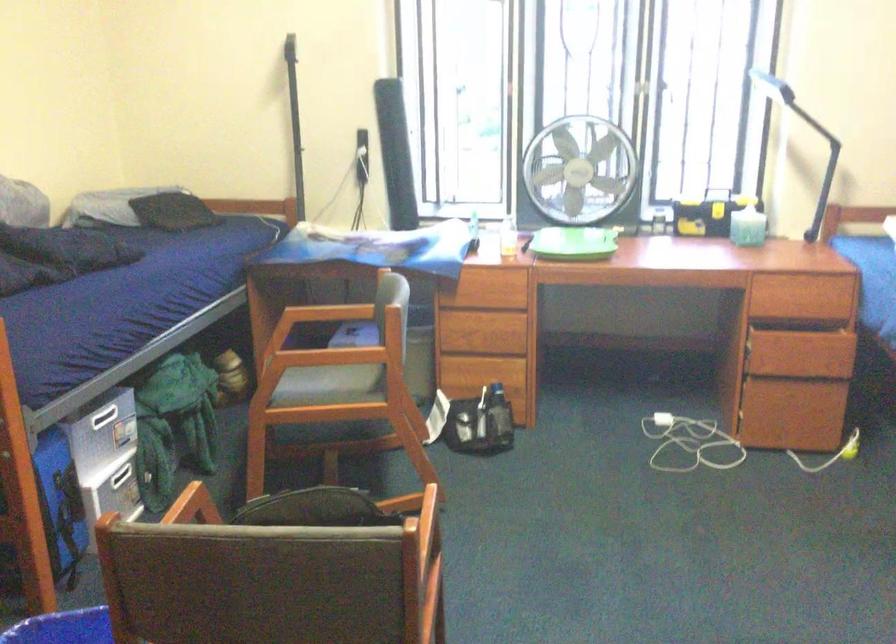
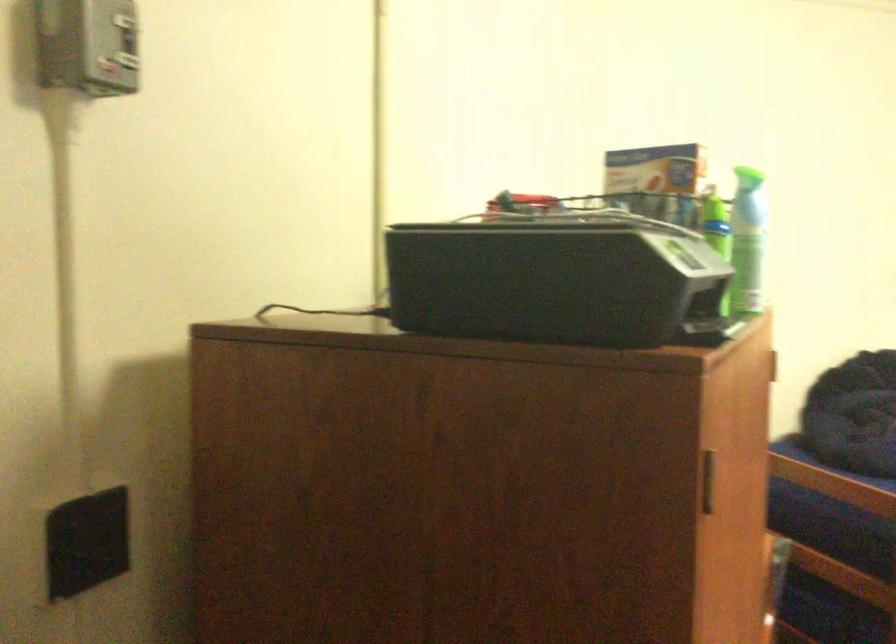
Question: The first image is from the beginning of the video and the second image is from the end. How did the camera likely rotate when shooting the video?

Choices:
 (A) Left
 (B) Right
 (C) Up
 (D) Down

Answer: (A)